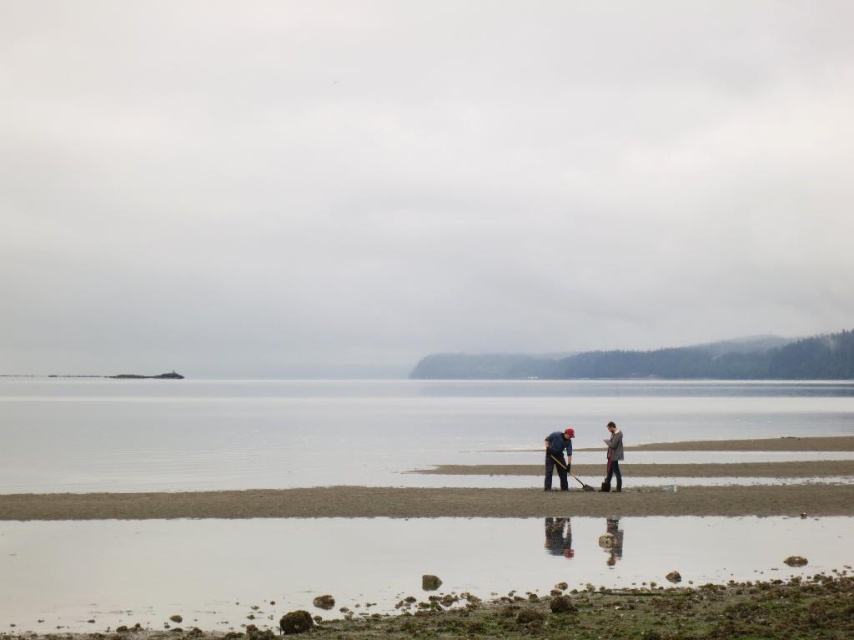
Who is more distant from viewer, (559, 460) or (619, 486)?

The point (559, 460) is behind.

Between blue fabric shirt at center and gray wool sweater at center, which one appears on the right side from the viewer's perspective?

Positioned to the right is gray wool sweater at center.

Find the location of a particular element. The width and height of the screenshot is (854, 640). blue fabric shirt at center is located at coordinates (557, 458).

The height and width of the screenshot is (640, 854). I want to click on blue fabric shirt at center, so click(x=557, y=458).

This screenshot has height=640, width=854. Describe the element at coordinates (557, 458) in the screenshot. I see `blue fabric jacket at center` at that location.

Is blue fabric jacket at center taller than gray wool sweater at center?

No.

Is point (613, 474) farther from viewer compared to point (611, 435)?

No, (613, 474) is in front of (611, 435).

Image resolution: width=854 pixels, height=640 pixels. Identify the location of blue fabric jacket at center. (557, 458).

Looking at this image, does blue fabric jacket at center have a lesser height compared to blue fabric shirt at center?

Indeed, blue fabric jacket at center has a lesser height compared to blue fabric shirt at center.

Is blue fabric jacket at center closer to camera compared to blue fabric shirt at center?

No.

The height and width of the screenshot is (640, 854). What do you see at coordinates (557, 458) in the screenshot?
I see `blue fabric jacket at center` at bounding box center [557, 458].

Find the location of a particular element. blue fabric jacket at center is located at coordinates (557, 458).